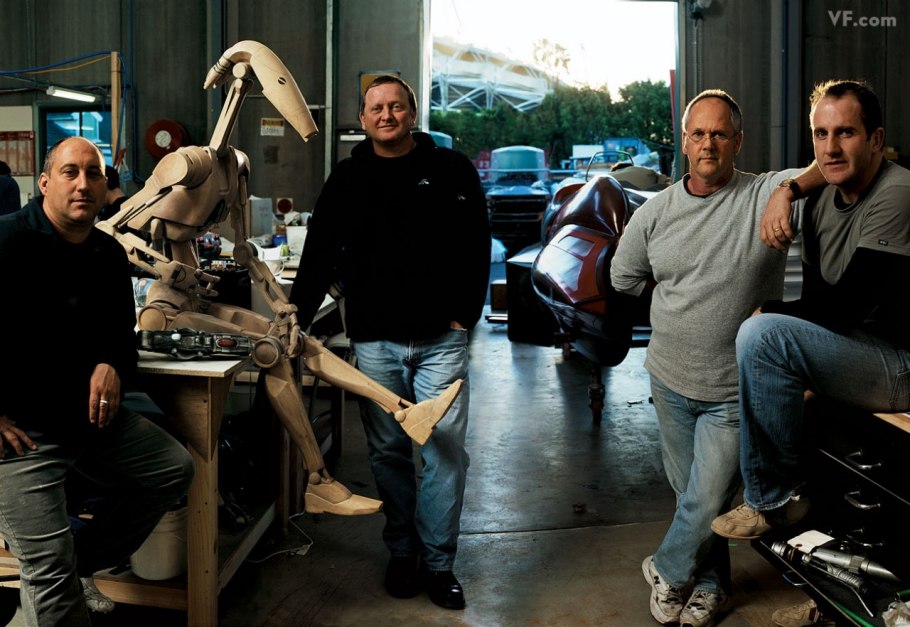
Find the location of `table`. table is located at coordinates pos(205,367).